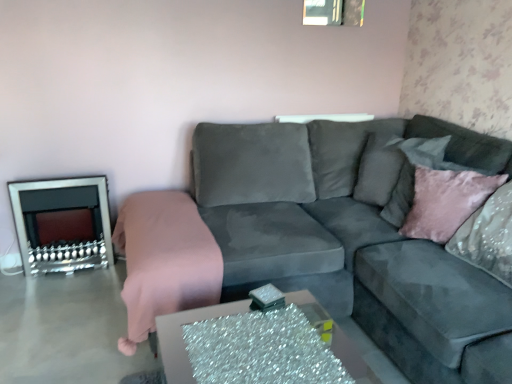
Describe the element at coordinates (182, 337) in the screenshot. This screenshot has height=384, width=512. I see `sparkly silver table at center` at that location.

The height and width of the screenshot is (384, 512). In order to click on pink velvet cushion at right in this screenshot , I will do `click(446, 201)`.

Measure the distance between velvet gray pillow at upper right and camera.

velvet gray pillow at upper right and camera are 2.07 meters apart.

What are the coordinates of `pink velvet blanket at left` in the screenshot? It's located at click(164, 260).

From the image's perspective, between sparkly silver table at center and velvet gray pillow at upper right, which one is located above?

velvet gray pillow at upper right is shown above in the image.

Between sparkly silver table at center and velvet gray pillow at upper right, which one is positioned behind?

velvet gray pillow at upper right is behind.

Is sparkly silver table at center surrounding velvet gray pillow at upper right?

No, velvet gray pillow at upper right is located outside of sparkly silver table at center.

How far apart are sparkly silver table at center and velvet gray pillow at upper right?

sparkly silver table at center is 34.69 inches away from velvet gray pillow at upper right.

Is pink velvet blanket at left not close to velvet gray couch at center?

pink velvet blanket at left is actually quite close to velvet gray couch at center.

Based on their positions, is pink velvet blanket at left located to the left or right of velvet gray couch at center?

pink velvet blanket at left is to the left of velvet gray couch at center.

Looking at this image, how different are the orientations of pink velvet blanket at left and velvet gray couch at center in degrees?

pink velvet blanket at left and velvet gray couch at center are facing 87.7 degrees away from each other.

Can you confirm if pink velvet blanket at left is smaller than velvet gray couch at center?

Yes.

Is pink velvet cushion at right not inside velvet gray couch at center?

Actually, pink velvet cushion at right is at least partially inside velvet gray couch at center.

Is velvet gray couch at center at the back of pink velvet cushion at right?

Yes.

Is pink velvet cushion at right bigger than velvet gray couch at center?

No.

Can you tell me how much pink velvet cushion at right and velvet gray couch at center differ in facing direction?

42.3 degrees.

Is sparkly silver table at center facing away from pink velvet cushion at right?

Yes.

From a real-world perspective, which is physically below, sparkly silver table at center or pink velvet cushion at right?

sparkly silver table at center is physically lower.

At what (x,y) coordinates should I click in order to perform the action: click on table below the pink velvet cushion at right (from the image's perspective). Please return your answer as a coordinate pair (x, y). The height and width of the screenshot is (384, 512). Looking at the image, I should click on (182, 337).

Is sparkly silver table at center to the left or to the right of pink velvet cushion at right in the image?

sparkly silver table at center is to the left of pink velvet cushion at right.

Is velvet gray pillow at upper right located outside silver metallic fireplace at left?

Yes, velvet gray pillow at upper right is outside of silver metallic fireplace at left.

There is a silver metallic fireplace at left. At what (x,y) coordinates should I click in order to perform the action: click on pillow above it (from a real-world perspective). Please return your answer as a coordinate pair (x, y). The image size is (512, 384). Looking at the image, I should click on (413, 173).

From the image's perspective, which one is positioned higher, velvet gray pillow at upper right or silver metallic fireplace at left?

velvet gray pillow at upper right appears higher in the image.

Can you tell me how much velvet gray pillow at upper right and silver metallic fireplace at left differ in facing direction?

There is a 55.4-degree angle between the facing directions of velvet gray pillow at upper right and silver metallic fireplace at left.

Is pink velvet blanket at left positioned in front of sparkly silver table at center?

No, it is behind sparkly silver table at center.

Based on their sizes in the image, would you say pink velvet blanket at left is bigger or smaller than sparkly silver table at center?

In the image, pink velvet blanket at left appears to be larger than sparkly silver table at center.

From a real-world perspective, is pink velvet blanket at left physically located above or below sparkly silver table at center?

pink velvet blanket at left is above sparkly silver table at center.

Which is behind, point (484, 317) or point (395, 215)?

Positioned behind is point (395, 215).

Could you tell me if velvet gray couch at center is turned towards velvet gray pillow at upper right?

Yes, velvet gray couch at center is oriented towards velvet gray pillow at upper right.

This screenshot has height=384, width=512. Find the location of `table below the velvet gray pillow at upper right (from the image's perspective)`. table below the velvet gray pillow at upper right (from the image's perspective) is located at coordinates (182, 337).

Identify the location of bedding below the velvet gray couch at center (from a real-world perspective). The image size is (512, 384). (164, 260).

Looking at the image, which one is located further to velvet gray pillow at upper right, sparkly silver table at center or silver metallic fireplace at left?

The object further to velvet gray pillow at upper right is silver metallic fireplace at left.

Looking at the image, which one is located further to velvet gray couch at center, velvet gray pillow at upper right or sparkly silver table at center?

sparkly silver table at center is further to velvet gray couch at center.

Estimate the real-world distances between objects in this image. Which object is closer to velvet gray couch at center, sparkly silver table at center or pink velvet cushion at right?

Based on the image, pink velvet cushion at right appears to be nearer to velvet gray couch at center.

Estimate the real-world distances between objects in this image. Which object is further from velvet gray pillow at upper right, sparkly silver table at center or pink velvet cushion at right?

Among the two, sparkly silver table at center is located further to velvet gray pillow at upper right.

Estimate the real-world distances between objects in this image. Which object is further from pink velvet cushion at right, sparkly silver table at center or velvet gray pillow at upper right?

The object further to pink velvet cushion at right is sparkly silver table at center.

From the image, which object appears to be nearer to silver metallic fireplace at left, pink velvet blanket at left or sparkly silver table at center?

pink velvet blanket at left lies closer to silver metallic fireplace at left than the other object.

Based on their spatial positions, is velvet gray pillow at upper right or velvet gray couch at center further from pink velvet blanket at left?

velvet gray pillow at upper right is further to pink velvet blanket at left.

Estimate the real-world distances between objects in this image. Which object is closer to pink velvet blanket at left, pink velvet cushion at right or silver metallic fireplace at left?

Among the two, silver metallic fireplace at left is located nearer to pink velvet blanket at left.

Locate an element on the screen. The width and height of the screenshot is (512, 384). bedding positioned between sparkly silver table at center and silver metallic fireplace at left from near to far is located at coordinates (164, 260).

This screenshot has width=512, height=384. Find the location of `studio couch located between pink velvet blanket at left and velvet gray pillow at upper right in the left-right direction`. studio couch located between pink velvet blanket at left and velvet gray pillow at upper right in the left-right direction is located at coordinates coord(353,240).

Find the location of a particular element. Image resolution: width=512 pixels, height=384 pixels. pillow between silver metallic fireplace at left and pink velvet cushion at right from left to right is located at coordinates (413, 173).

You are a GUI agent. You are given a task and a screenshot of the screen. Output one action in this format:
    pyautogui.click(x=<x>, y=<y>)
    Task: Click on the studio couch between sparkly silver table at center and velvet gray pillow at upper right from front to back
    The width and height of the screenshot is (512, 384).
    Given the screenshot: What is the action you would take?
    pyautogui.click(x=353, y=240)